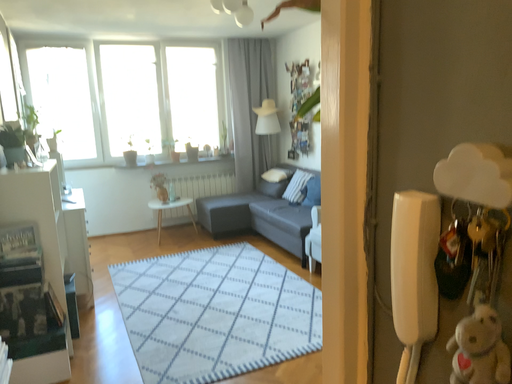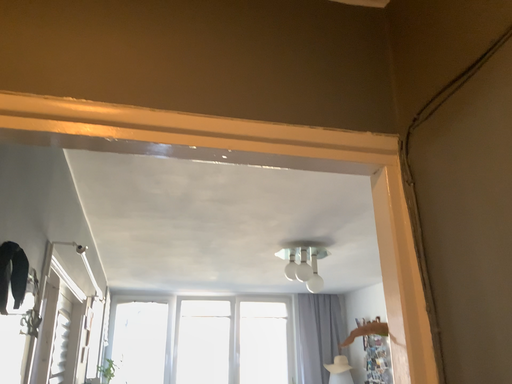
Question: How did the camera likely rotate when shooting the video?

Choices:
 (A) rotated left
 (B) rotated right

Answer: (A)